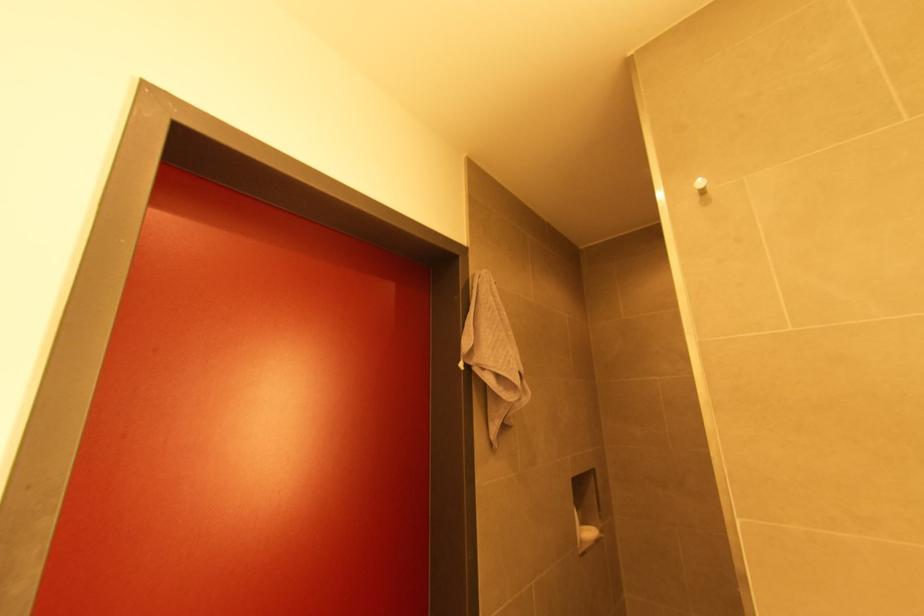
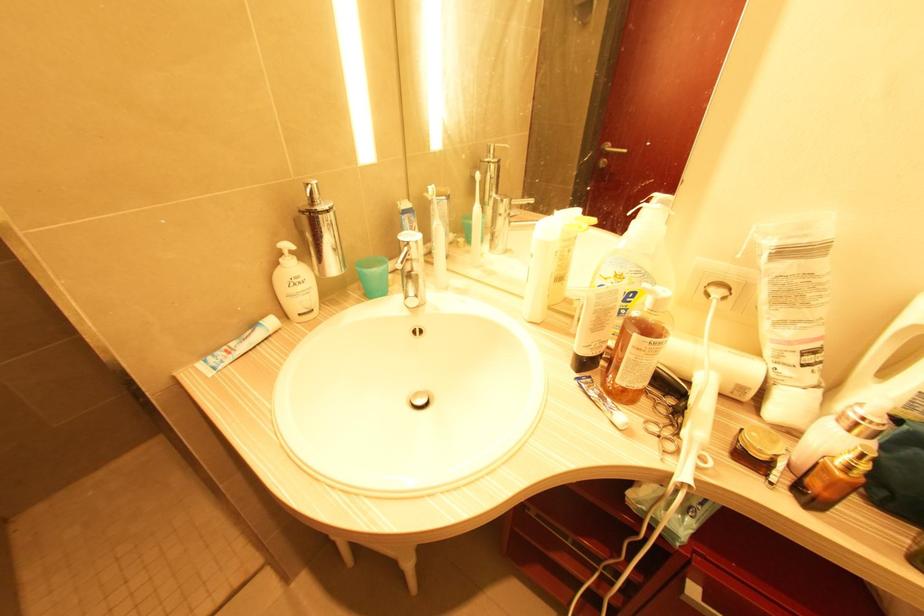
How did the camera likely rotate?

The camera rotated toward right-down.